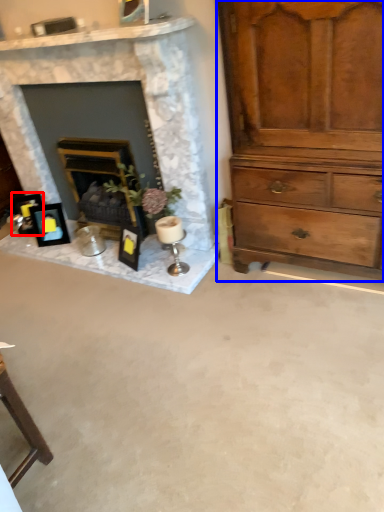
Question: Which object appears farthest to the camera in this image, picture frame (highlighted by a red box) or chest of drawers (highlighted by a blue box)?

Choices:
 (A) picture frame
 (B) chest of drawers

Answer: (A)